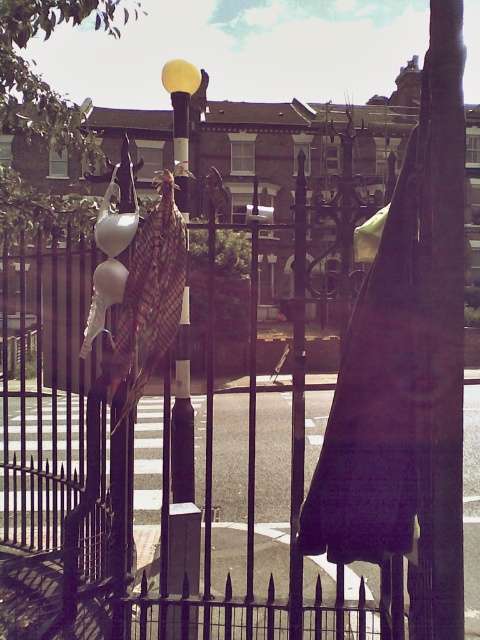
Does plaid fabric umbrella at center appear under matte white balloon at center?

Indeed, plaid fabric umbrella at center is positioned under matte white balloon at center.

Between plaid fabric umbrella at center and matte white balloon at center, which one has less height?

Standing shorter between the two is matte white balloon at center.

Identify the location of plaid fabric umbrella at center. The width and height of the screenshot is (480, 640). (151, 296).

Which is behind, point (412, 282) or point (115, 268)?

The point (115, 268) is behind.

Which of these two, matte black umbrella at center or matte white balloon at center, stands shorter?

matte white balloon at center

Does point (381, 387) come closer to viewer compared to point (109, 259)?

Yes, it is in front of point (109, 259).

Identify the location of matte black umbrella at center. The width and height of the screenshot is (480, 640). (372, 406).

Can you confirm if matte black umbrella at center is thinner than white glossy balloon at center?

No.

Image resolution: width=480 pixels, height=640 pixels. I want to click on matte black umbrella at center, so click(372, 406).